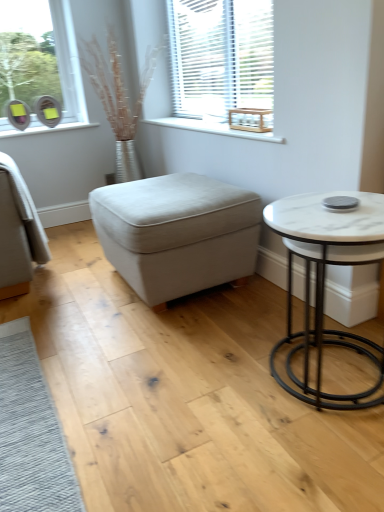
The width and height of the screenshot is (384, 512). I want to click on free space behind white marble table at right, so click(266, 321).